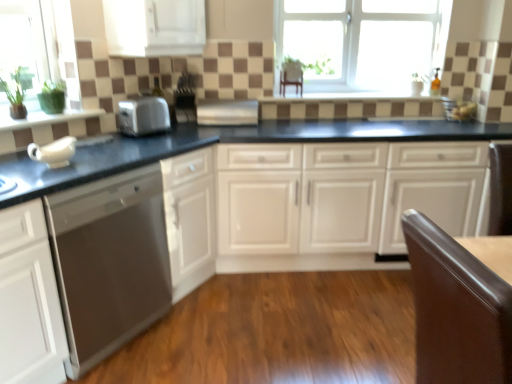
Locate an element on the screen. free space in front of satin silver toaster at center, arranged as the 2th appliance when viewed from the right is located at coordinates (181, 129).